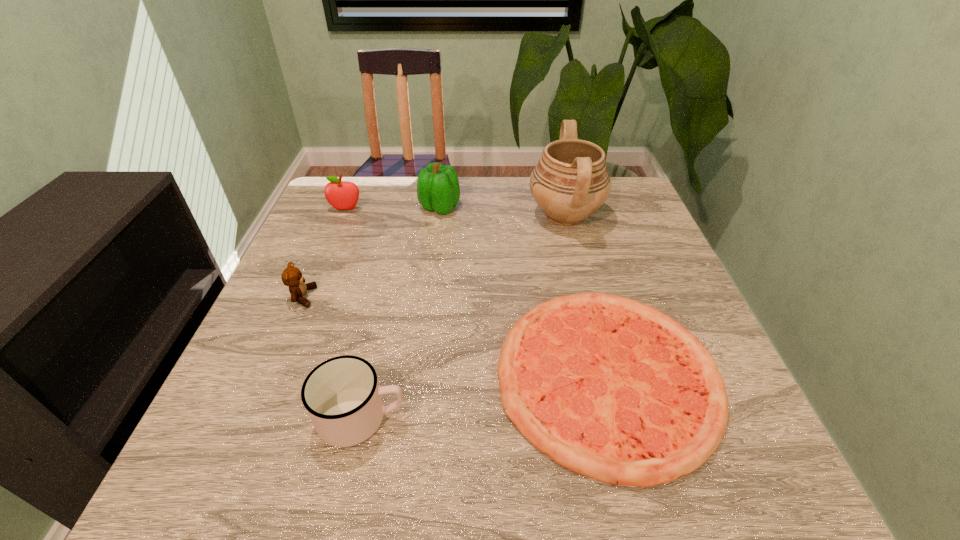
I want to click on vacant space at the far left corner of the desktop, so click(370, 215).

In the image, there is a desktop. Where is `vacant area at the far right corner`? Image resolution: width=960 pixels, height=540 pixels. vacant area at the far right corner is located at coordinates (639, 202).

Identify the location of free location at the near right corner of the desktop. (759, 476).

Where is `free space between the mug and the pizza`? This screenshot has width=960, height=540. free space between the mug and the pizza is located at coordinates (484, 396).

Where is `vacant area between the bell pepper and the teddy bear`? The image size is (960, 540). vacant area between the bell pepper and the teddy bear is located at coordinates (372, 252).

Find the location of `unoccupied area between the urn and the fifth shortest object`. unoccupied area between the urn and the fifth shortest object is located at coordinates (502, 211).

The height and width of the screenshot is (540, 960). What are the coordinates of `free space between the mug and the teddy bear` in the screenshot? It's located at point(332,357).

Locate an element on the screen. free spot between the mug and the bell pepper is located at coordinates (400, 312).

Image resolution: width=960 pixels, height=540 pixels. I want to click on unoccupied position between the tallest object and the mug, so click(x=464, y=316).

Locate an element on the screen. Image resolution: width=960 pixels, height=540 pixels. free spot between the apple and the bell pepper is located at coordinates (393, 208).